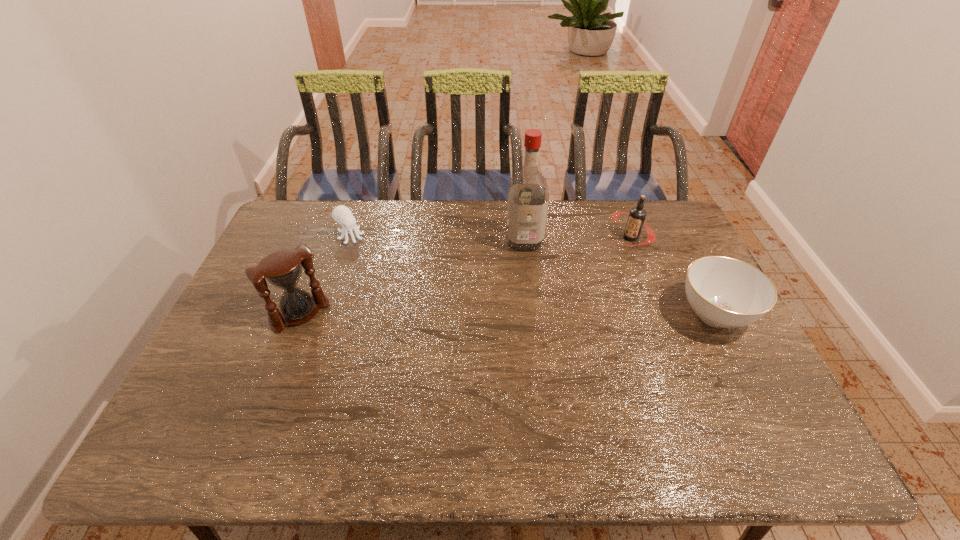
Locate an element on the screen. Image resolution: width=960 pixels, height=540 pixels. vacant space that satisfies the following two spatial constraints: 1. on the front side of the chinaware; 2. on the left side of the third object from right to left is located at coordinates (533, 314).

Find the location of a particular element. free location that satisfies the following two spatial constraints: 1. on the front side of the chinaware; 2. on the right side of the liquor is located at coordinates (533, 314).